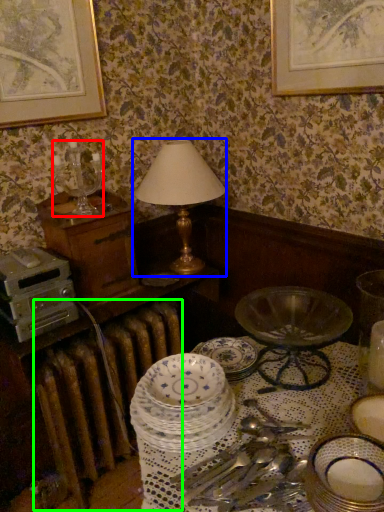
Question: Which is nearer to the candle holder (highlighted by a red box)? table lamp (highlighted by a blue box) or radiator (highlighted by a green box).

Choices:
 (A) table lamp
 (B) radiator

Answer: (A)